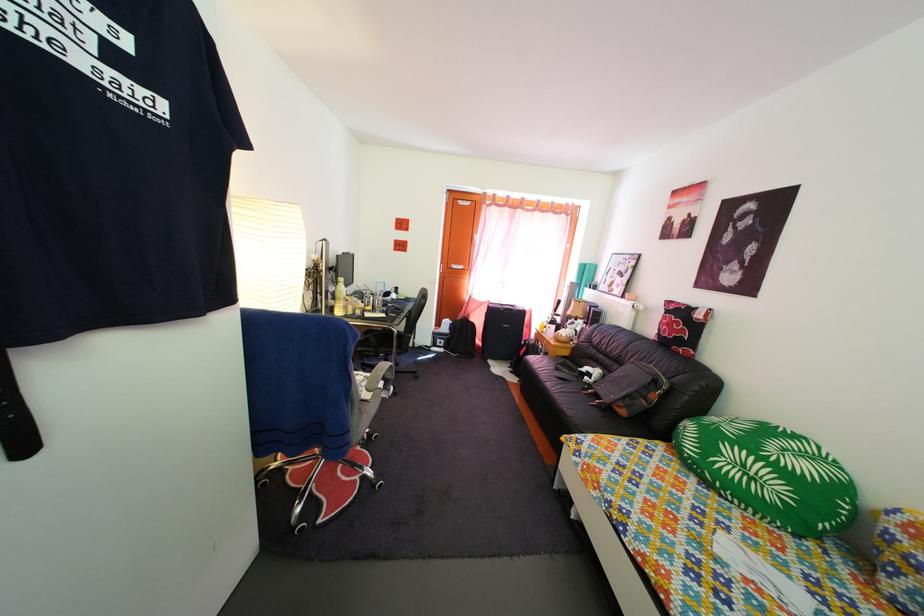
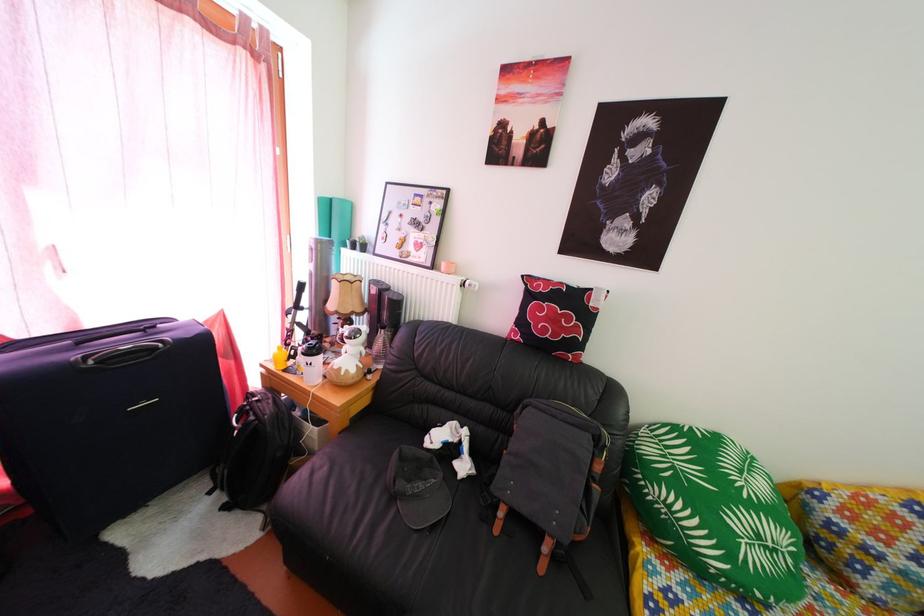
The point at (678, 333) is marked in the first image. Where is the corresponding point in the second image?

(562, 328)